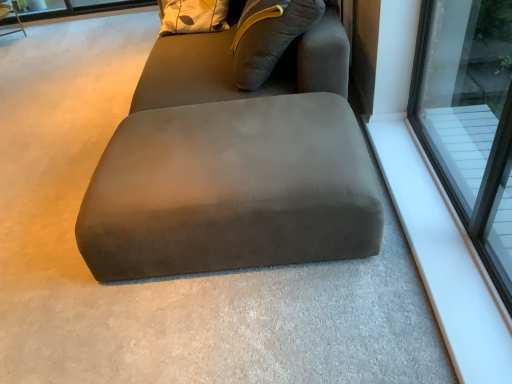
The image size is (512, 384). In order to click on free space above white smooth window sill at upper right (from a real-world perspective) in this screenshot , I will do `click(433, 220)`.